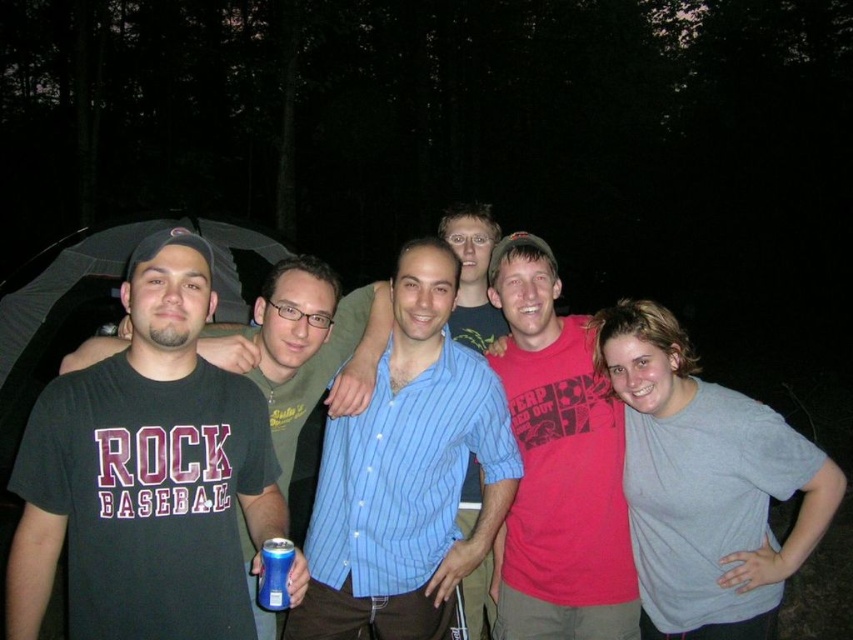
Which of these two, matte red shirt at center or blue plastic can at lower left, stands taller?

matte red shirt at center

Between matte red shirt at center and blue plastic can at lower left, which one appears on the left side from the viewer's perspective?

From the viewer's perspective, blue plastic can at lower left appears more on the left side.

The image size is (853, 640). I want to click on matte red shirt at center, so click(556, 467).

Where is `matte red shirt at center`? The height and width of the screenshot is (640, 853). matte red shirt at center is located at coordinates (556, 467).

Can you confirm if blue striped shirt at center is thinner than blue plastic can at lower left?

In fact, blue striped shirt at center might be wider than blue plastic can at lower left.

Who is more forward, [347,483] or [270,608]?

Positioned in front is point [270,608].

What are the coordinates of `blue striped shirt at center` in the screenshot? It's located at (407, 474).

Who is positioned more to the left, dark gray t-shirt at left or matte red shirt at center?

From the viewer's perspective, dark gray t-shirt at left appears more on the left side.

This screenshot has width=853, height=640. What are the coordinates of `dark gray t-shirt at left` in the screenshot? It's located at (144, 474).

Is point (171, 332) positioned behind point (585, 419)?

No.

Identify the location of dark gray t-shirt at left. (144, 474).